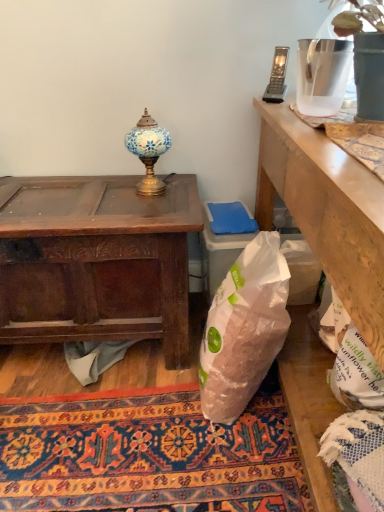
Question: Is the depth of clear plastic pitcher at upper right greater than that of translucent plastic vase at upper right?

Choices:
 (A) no
 (B) yes

Answer: (B)

Question: Does clear plastic pitcher at upper right have a greater height compared to translucent plastic vase at upper right?

Choices:
 (A) yes
 (B) no

Answer: (B)

Question: Is clear plastic pitcher at upper right completely or partially outside of translucent plastic vase at upper right?

Choices:
 (A) no
 (B) yes

Answer: (A)

Question: From a real-world perspective, is clear plastic pitcher at upper right located higher than translucent plastic vase at upper right?

Choices:
 (A) no
 (B) yes

Answer: (A)

Question: Is translucent plastic vase at upper right located within clear plastic pitcher at upper right?

Choices:
 (A) yes
 (B) no

Answer: (B)

Question: Considering the relative sizes of clear plastic pitcher at upper right and translucent plastic vase at upper right in the image provided, is clear plastic pitcher at upper right thinner than translucent plastic vase at upper right?

Choices:
 (A) yes
 (B) no

Answer: (A)

Question: Is clear plastic pitcher at upper right far away from gray fabric at lower center?

Choices:
 (A) yes
 (B) no

Answer: (A)

Question: Considering the relative sizes of clear plastic pitcher at upper right and gray fabric at lower center in the image provided, is clear plastic pitcher at upper right taller than gray fabric at lower center?

Choices:
 (A) yes
 (B) no

Answer: (A)

Question: From the image's perspective, is clear plastic pitcher at upper right on top of gray fabric at lower center?

Choices:
 (A) yes
 (B) no

Answer: (A)

Question: Is clear plastic pitcher at upper right next to gray fabric at lower center and touching it?

Choices:
 (A) no
 (B) yes

Answer: (A)

Question: From a real-world perspective, is clear plastic pitcher at upper right located beneath gray fabric at lower center?

Choices:
 (A) no
 (B) yes

Answer: (A)

Question: Is clear plastic pitcher at upper right to the right of gray fabric at lower center from the viewer's perspective?

Choices:
 (A) no
 (B) yes

Answer: (B)

Question: From a real-world perspective, is dark brown wood desk at left beneath clear plastic pitcher at upper right?

Choices:
 (A) yes
 (B) no

Answer: (A)